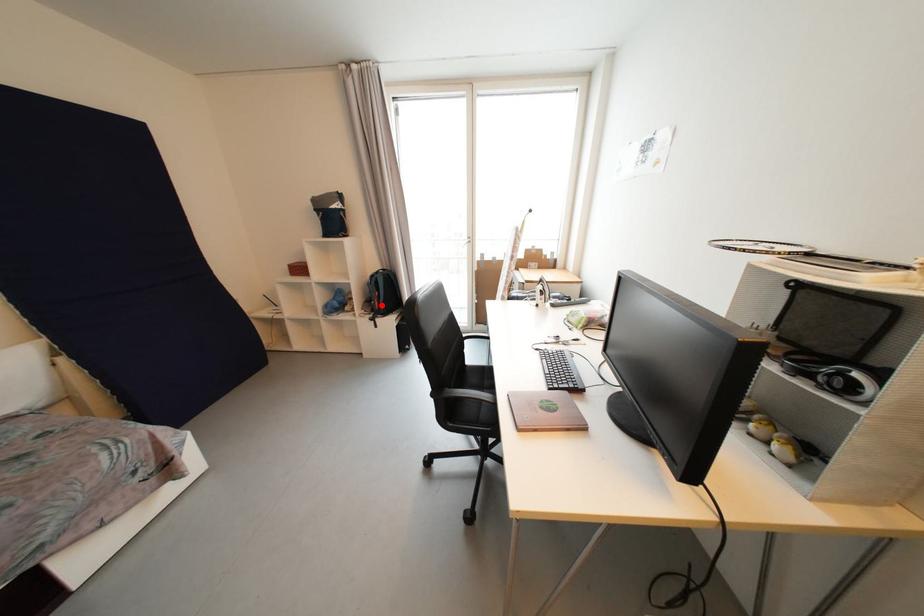
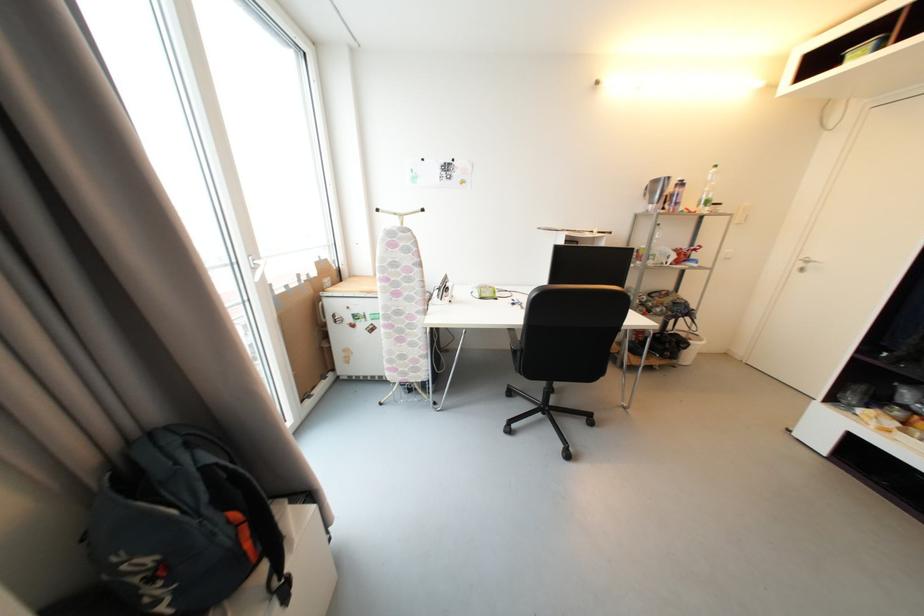
Where in the second image is the point corresponding to the highlighted location from the first image?

(253, 546)